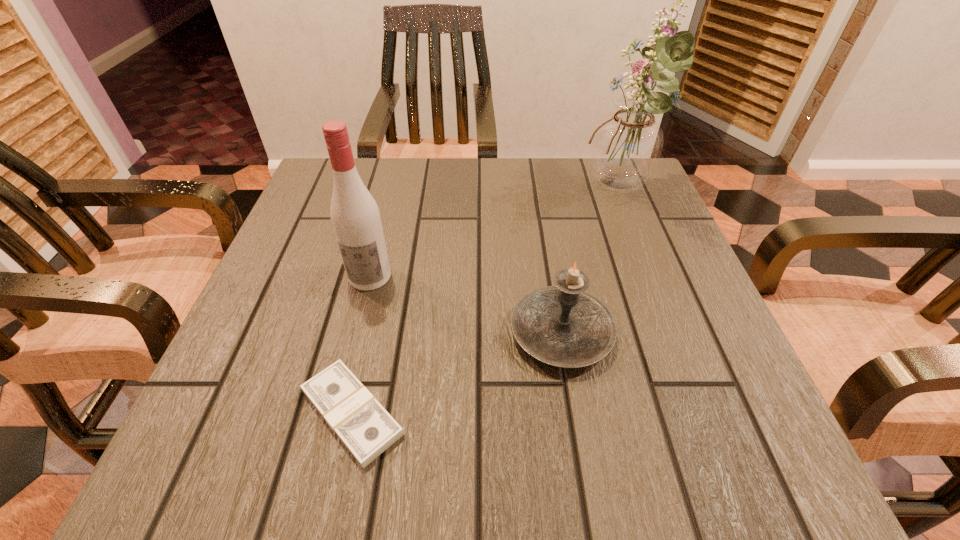
You are a GUI agent. You are given a task and a screenshot of the screen. Output one action in this format:
    pyautogui.click(x=<x>, y=<y>)
    Task: Click on the vacant space situated 0.090m on the label of the alcohol
    Image resolution: width=960 pixels, height=540 pixels.
    Given the screenshot: What is the action you would take?
    pyautogui.click(x=356, y=332)

The image size is (960, 540). What are the coordinates of `vacant point located 0.370m on the back of the third tallest object` in the screenshot? It's located at (537, 180).

Locate an element on the screen. vacant space situated 0.230m on the right of the dollar is located at coordinates (570, 413).

This screenshot has height=540, width=960. Find the location of `object located at the far edge`. object located at the far edge is located at coordinates (626, 146).

Locate an element on the screen. object that is at the near edge is located at coordinates (363, 425).

You are a GUI agent. You are given a task and a screenshot of the screen. Output one action in this format:
    pyautogui.click(x=<x>, y=<y>)
    Task: Click on the alcohol at the left edge
    This screenshot has width=960, height=540.
    Given the screenshot: What is the action you would take?
    356,220

Locate an element on the screen. dollar situated at the left edge is located at coordinates (363, 425).

Where is `object present at the right edge`? The height and width of the screenshot is (540, 960). object present at the right edge is located at coordinates (626, 146).

I want to click on object located at the near left corner, so click(x=363, y=425).

You are a GUI agent. You are given a task and a screenshot of the screen. Output one action in this format:
    pyautogui.click(x=<x>, y=<y>)
    Task: Click on the object that is positioned at the far right corner
    
    Given the screenshot: What is the action you would take?
    pyautogui.click(x=626, y=146)